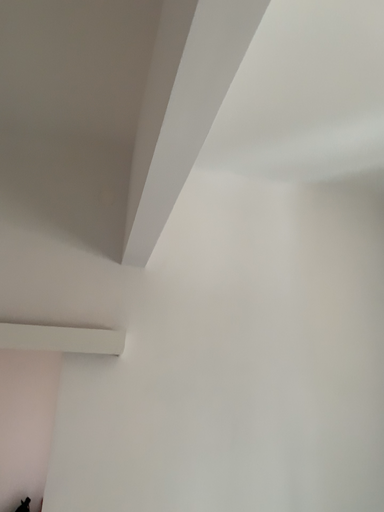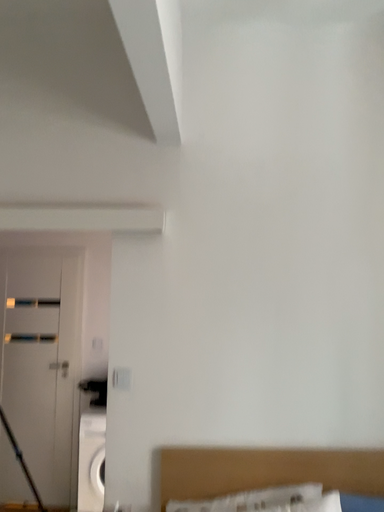
Question: How did the camera likely rotate when shooting the video?

Choices:
 (A) rotated left
 (B) rotated right

Answer: (A)